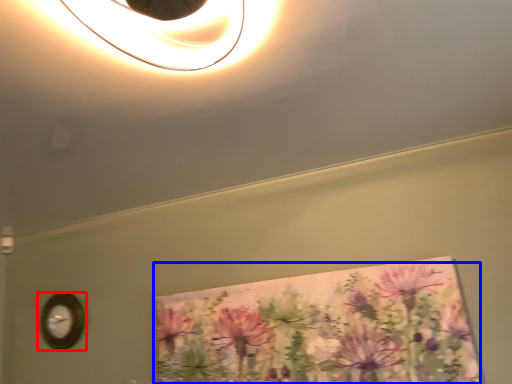
Question: Among these objects, which one is nearest to the camera, wall clock (highlighted by a red box) or flower (highlighted by a blue box)?

Choices:
 (A) wall clock
 (B) flower

Answer: (B)